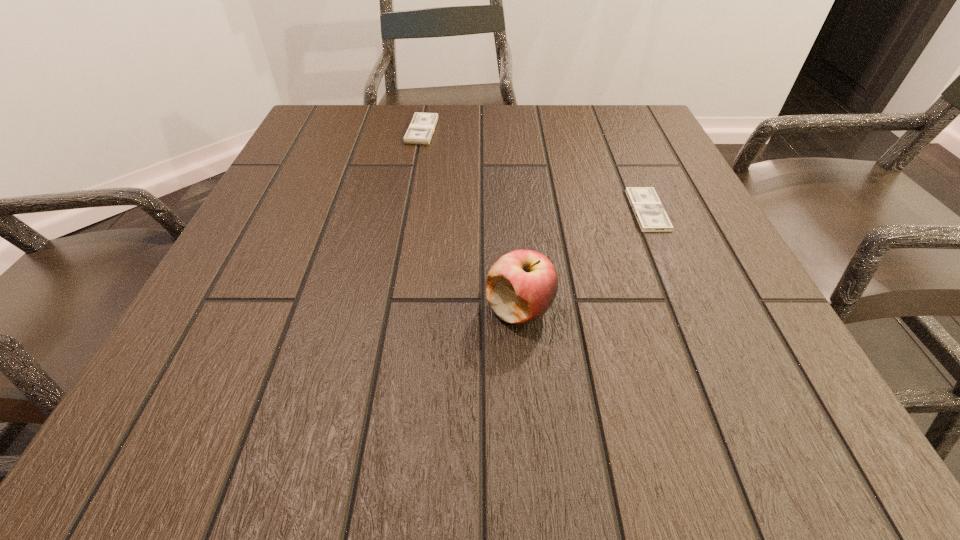
This screenshot has width=960, height=540. Find the location of `object that is at the right edge`. object that is at the right edge is located at coordinates (x=648, y=209).

The height and width of the screenshot is (540, 960). Identify the location of vacant space at the far edge of the desktop. (543, 114).

Locate an element on the screen. The height and width of the screenshot is (540, 960). free space at the left edge is located at coordinates (189, 374).

In the image, there is a desktop. Where is `free space at the right edge`? Image resolution: width=960 pixels, height=540 pixels. free space at the right edge is located at coordinates (687, 249).

Where is `free spot at the far left corner of the desktop`? The height and width of the screenshot is (540, 960). free spot at the far left corner of the desktop is located at coordinates (327, 142).

Image resolution: width=960 pixels, height=540 pixels. What are the coordinates of `free space at the far right corner of the desktop` in the screenshot? It's located at (636, 107).

Find the location of a particular element. vacant region at the near right corner of the desktop is located at coordinates pyautogui.click(x=733, y=431).

Locate an element on the screen. This screenshot has width=960, height=540. free point between the tallest object and the farthest object is located at coordinates (471, 220).

Image resolution: width=960 pixels, height=540 pixels. I want to click on empty space between the apple and the farther dollar, so click(x=471, y=220).

You are a GUI agent. You are given a task and a screenshot of the screen. Output one action in this format:
    pyautogui.click(x=<x>, y=<y>)
    Task: Click on the free spot between the farthest object and the second farthest object
    This screenshot has height=540, width=960.
    Given the screenshot: What is the action you would take?
    pyautogui.click(x=535, y=171)